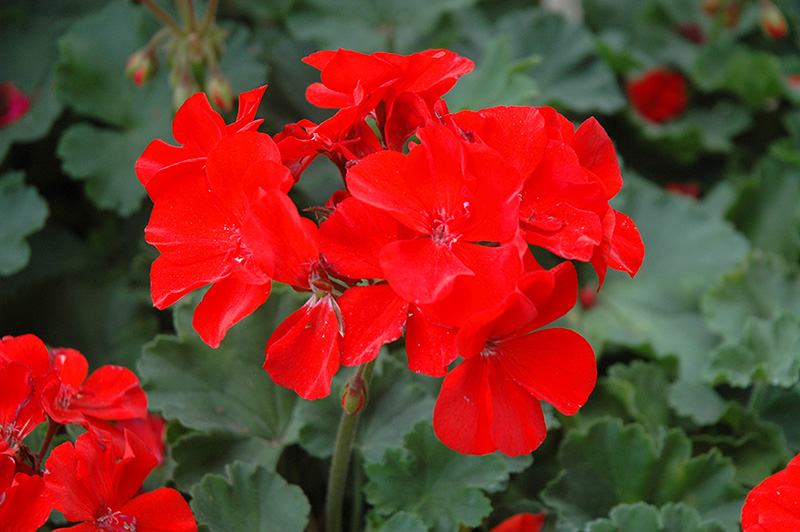
You are a GUI agent. You are given a task and a screenshot of the screen. Output one action in this format:
    pyautogui.click(x=<x>, y=<y>)
    Task: Click on the bouquet
    Image resolution: width=800 pixels, height=532 pixels.
    Given the screenshot: What is the action you would take?
    pyautogui.click(x=378, y=304)